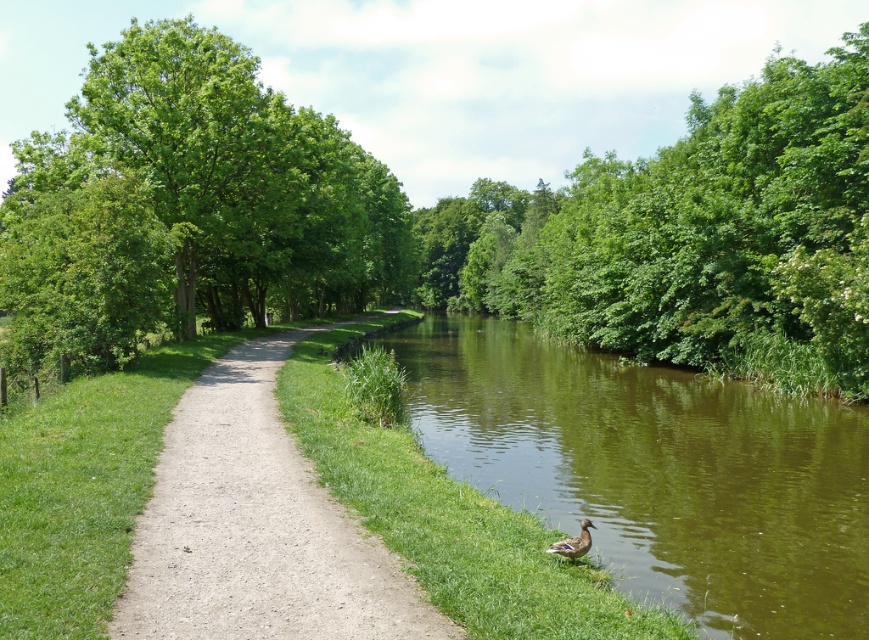
Question: Does green leafy trees at center appear on the left side of brown fuzzy duck at lower center?

Choices:
 (A) no
 (B) yes

Answer: (A)

Question: Is green leafy trees at center positioned in front of green grassy river at center?

Choices:
 (A) yes
 (B) no

Answer: (B)

Question: Which point is closer to the camera?

Choices:
 (A) green leafy trees at center
 (B) green grassy river at center
 (C) dirt path at center
 (D) brown fuzzy duck at lower center

Answer: (C)

Question: Considering the real-world distances, which object is farthest from the green grassy river at center?

Choices:
 (A) green leafy trees at center
 (B) brown fuzzy duck at lower center
 (C) dirt path at center

Answer: (A)

Question: Which point is farther from the camera taking this photo?

Choices:
 (A) (564, 548)
 (B) (290, 461)

Answer: (B)

Question: Does green leafy trees at center appear under dirt path at center?

Choices:
 (A) yes
 (B) no

Answer: (B)